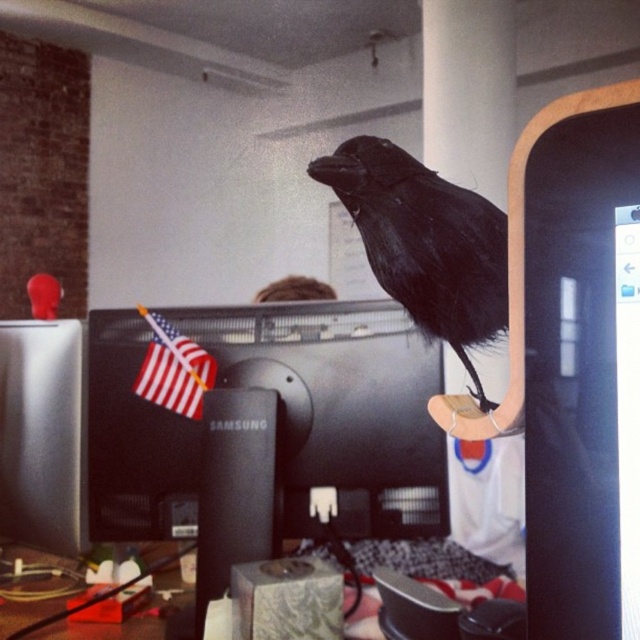
Does point (355, 524) come in front of point (145, 380)?

That is True.

Does point (92, 456) lie in front of point (173, 400)?

No.

This screenshot has width=640, height=640. What are the coordinates of `black matte computer monitor at center` in the screenshot? It's located at (339, 406).

How distant is shiny black bird at center from american flag with glossy surface at center-left?

A distance of 20.03 inches exists between shiny black bird at center and american flag with glossy surface at center-left.

Is shiny black bird at center shorter than american flag with glossy surface at center-left?

No.

Is point (497, 307) positioned behind point (188, 365)?

No, (497, 307) is closer to viewer.

You are a GUI agent. You are given a task and a screenshot of the screen. Output one action in this format:
    pyautogui.click(x=<x>, y=<y>)
    Task: Click on the shiny black bird at center
    
    Given the screenshot: What is the action you would take?
    426,243

Based on the photo, is black matte computer monitor at center further to camera compared to shiny black bird at center?

Yes, it is behind shiny black bird at center.

Can you confirm if black matte computer monitor at center is taller than shiny black bird at center?

Indeed, black matte computer monitor at center has a greater height compared to shiny black bird at center.

Is point (116, 529) in front of point (422, 208)?

No.

Where is `black matte computer monitor at center`? This screenshot has width=640, height=640. black matte computer monitor at center is located at coordinates (339, 406).